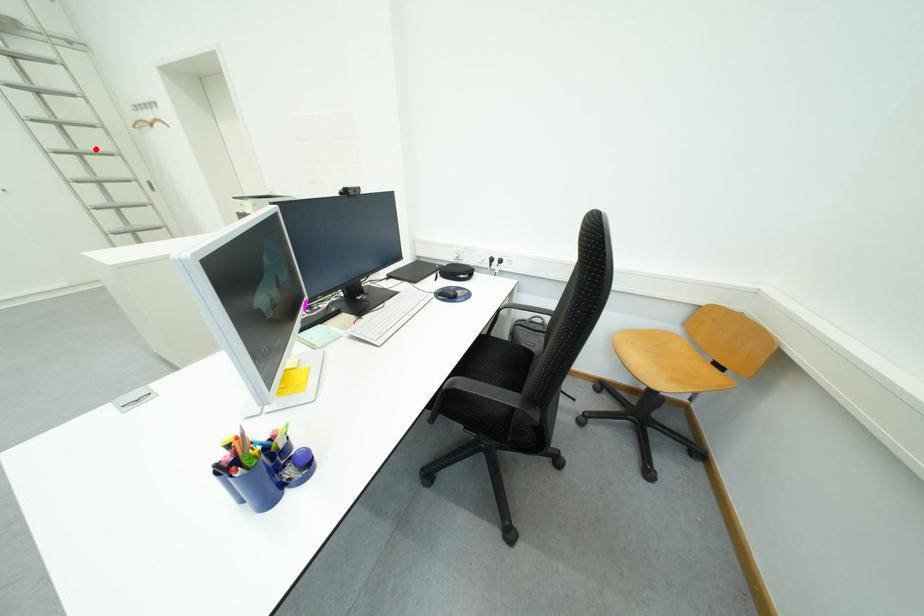
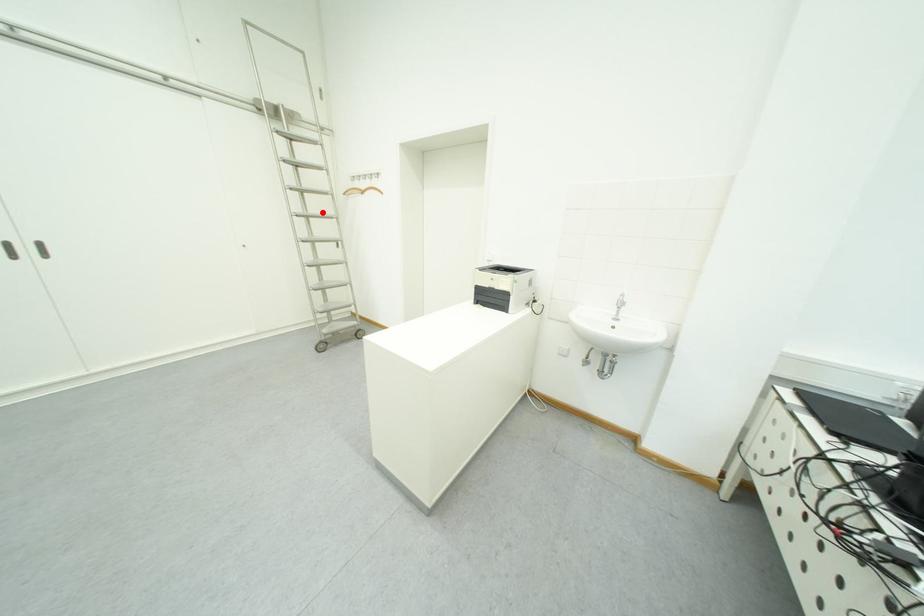
I am providing you with two images of the same scene from different viewpoints. A red point is marked on the first image and another point is marked on the second image. Are the points marked in image1 and image2 representing the same 3D position?

Yes